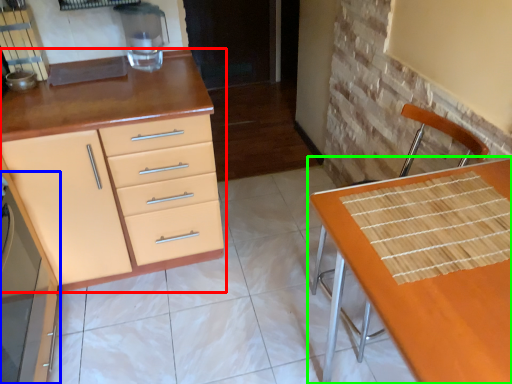
Question: Which object is the farthest from cabinetry (highlighted by a red box)? Choose among these: cabinetry (highlighted by a blue box) or table (highlighted by a green box).

Choices:
 (A) cabinetry
 (B) table

Answer: (B)